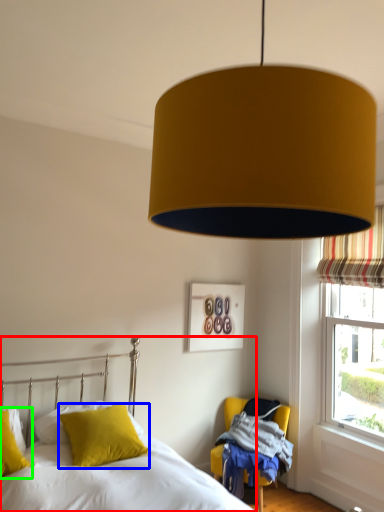
Question: Based on their relative distances, which object is farther from bed (highlighted by a red box)? Choose from pillow (highlighted by a blue box) and pillow (highlighted by a green box).

Choices:
 (A) pillow
 (B) pillow

Answer: (B)